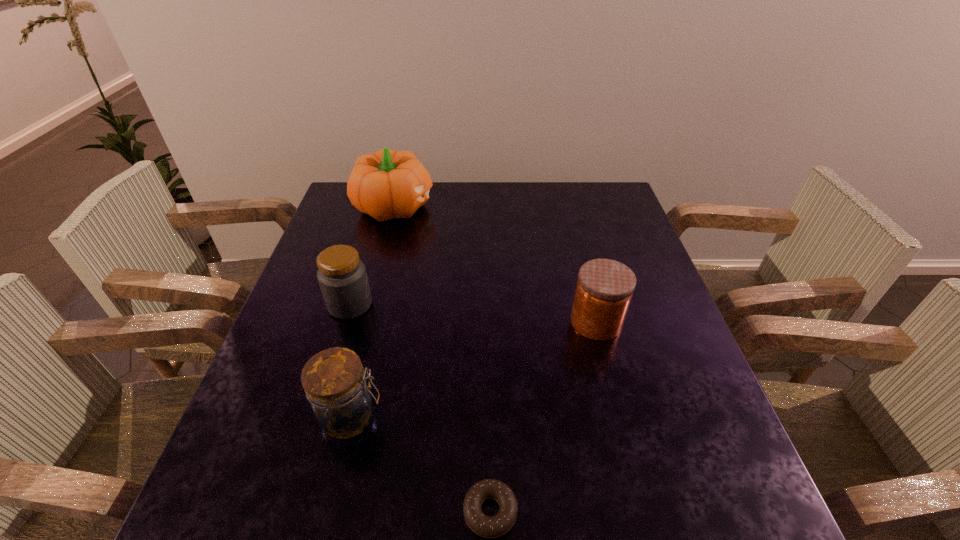
I want to click on object at the far left corner, so click(x=387, y=184).

The height and width of the screenshot is (540, 960). Identify the location of blank space at the far edge. (494, 208).

In the image, there is a desktop. Where is `vacant space at the near edge`? This screenshot has width=960, height=540. vacant space at the near edge is located at coordinates (300, 525).

Where is `free spot at the left edge of the desktop`? The height and width of the screenshot is (540, 960). free spot at the left edge of the desktop is located at coordinates (325, 231).

Where is `free space at the right edge of the desktop`? The image size is (960, 540). free space at the right edge of the desktop is located at coordinates (636, 370).

Where is `blank area at the far left corner`? blank area at the far left corner is located at coordinates (350, 205).

I want to click on vacant space at the near left corner, so click(223, 484).

Find the location of `vacant space at the far right corner of the desktop`. vacant space at the far right corner of the desktop is located at coordinates (583, 194).

Locate an element on the screen. This screenshot has width=960, height=540. free area in between the rightmost jar and the fourth farthest object is located at coordinates (473, 369).

This screenshot has width=960, height=540. What are the coordinates of `vacant point located between the tallest object and the second nearest object` in the screenshot? It's located at (372, 311).